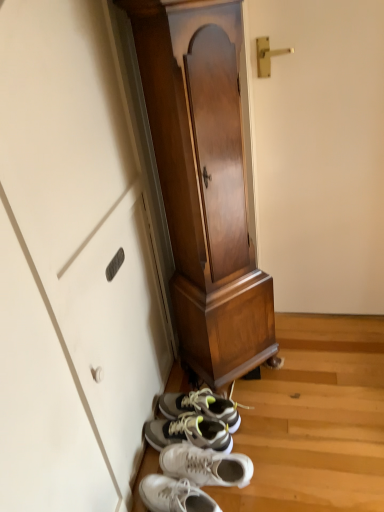
You are a GUI agent. You are given a task and a screenshot of the screen. Output one action in this format:
    pyautogui.click(x=<x>, y=<y>)
    Task: Click on the wooden cabinet at center
    This screenshot has width=384, height=512.
    Given the screenshot: What is the action you would take?
    pyautogui.click(x=200, y=208)

Describe the element at coordinates (200, 208) in the screenshot. The width and height of the screenshot is (384, 512). I see `wooden cabinet at center` at that location.

What do you see at coordinates (202, 452) in the screenshot?
I see `white leather sneakers at lower center` at bounding box center [202, 452].

Where is `white leather sneakers at lower center`? The width and height of the screenshot is (384, 512). white leather sneakers at lower center is located at coordinates (202, 452).

In order to face white leather sneakers at lower center, should I rotate leftwards or rightwards?

A 0.386 degree turn to the right will do.

Where is `wooden cabinet at center`? The image size is (384, 512). wooden cabinet at center is located at coordinates (200, 208).

Is white leather sneakers at lower center at the right side of wooden cabinet at center?

No, white leather sneakers at lower center is not to the right of wooden cabinet at center.

Is white leather sneakers at lower center closer to the viewer compared to wooden cabinet at center?

No, it is behind wooden cabinet at center.

Is point (234, 481) positioned after point (170, 134)?

Yes, it is.

From the image's perspective, which one is positioned higher, white leather sneakers at lower center or wooden cabinet at center?

From the image's view, wooden cabinet at center is above.

From a real-world perspective, between white leather sneakers at lower center and wooden cabinet at center, who is vertically lower?

white leather sneakers at lower center.

Which of these two, white leather sneakers at lower center or wooden cabinet at center, is wider?

Wider between the two is white leather sneakers at lower center.

Can you confirm if white leather sneakers at lower center is shorter than wooden cabinet at center?

Indeed, white leather sneakers at lower center has a lesser height compared to wooden cabinet at center.

Which of these two, white leather sneakers at lower center or wooden cabinet at center, is bigger?

wooden cabinet at center.

From the picture: Is white leather sneakers at lower center outside of wooden cabinet at center?

Absolutely, white leather sneakers at lower center is external to wooden cabinet at center.

Are white leather sneakers at lower center and wooden cabinet at center beside each other?

No.

Could you tell me if white leather sneakers at lower center is facing wooden cabinet at center?

No, white leather sneakers at lower center is not turned towards wooden cabinet at center.

Measure the distance from white leather sneakers at lower center to wooden cabinet at center.

15.59 inches.

The width and height of the screenshot is (384, 512). Find the location of `furniture located above the white leather sneakers at lower center (from a real-world perspective)`. furniture located above the white leather sneakers at lower center (from a real-world perspective) is located at coordinates (200, 208).

Which object is positioned more to the right, wooden cabinet at center or white leather sneakers at lower center?

From the viewer's perspective, wooden cabinet at center appears more on the right side.

Does wooden cabinet at center lie in front of white leather sneakers at lower center?

Yes, it is.

Is point (206, 258) less distant than point (206, 443)?

Yes, it is.

From the image's perspective, is wooden cabinet at center located above white leather sneakers at lower center?

Correct, wooden cabinet at center appears higher than white leather sneakers at lower center in the image.

Looking at this image, from a real-world perspective, who is located higher, wooden cabinet at center or white leather sneakers at lower center?

In real-world perspective, wooden cabinet at center is above.

Between wooden cabinet at center and white leather sneakers at lower center, which one has smaller width?

With smaller width is wooden cabinet at center.

Is wooden cabinet at center taller or shorter than white leather sneakers at lower center?

wooden cabinet at center is taller than white leather sneakers at lower center.

Based on the photo, between wooden cabinet at center and white leather sneakers at lower center, which one has smaller size?

Smaller between the two is white leather sneakers at lower center.

Which is correct: wooden cabinet at center is inside white leather sneakers at lower center, or outside of it?

wooden cabinet at center cannot be found inside white leather sneakers at lower center.

Would you say wooden cabinet at center is a long distance from white leather sneakers at lower center?

wooden cabinet at center is actually quite close to white leather sneakers at lower center.

Is wooden cabinet at center facing away from white leather sneakers at lower center?

wooden cabinet at center is not turned away from white leather sneakers at lower center.

Locate an element on the screen. This screenshot has width=384, height=512. shoe that appears on the left of wooden cabinet at center is located at coordinates (202, 452).

Where is `furniture on the right of white leather sneakers at lower center`? furniture on the right of white leather sneakers at lower center is located at coordinates (200, 208).

The height and width of the screenshot is (512, 384). What are the coordinates of `furniture lying above the white leather sneakers at lower center (from the image's perspective)` in the screenshot? It's located at (200, 208).